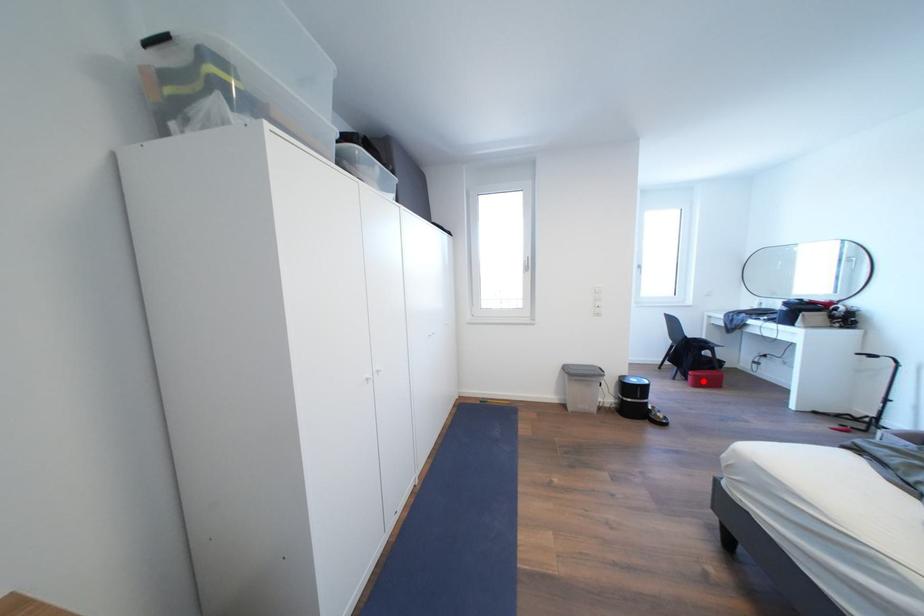
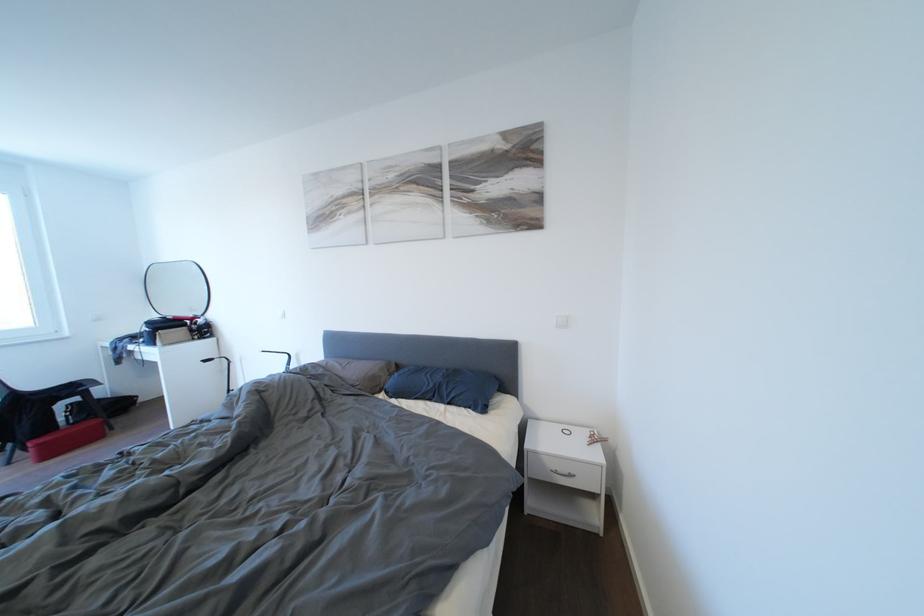
In the second image, find the point that corresponds to the highlighted location in the first image.

(46, 450)